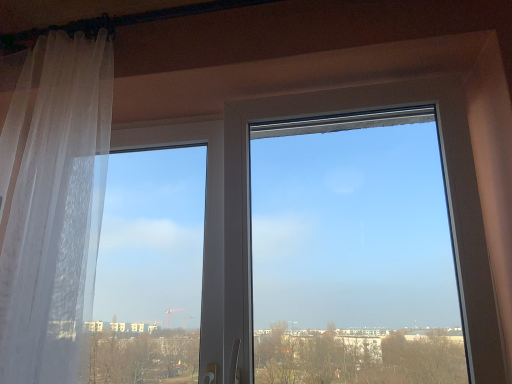
Describe the element at coordinates (353, 251) in the screenshot. I see `transparent glass window at center` at that location.

Locate an element on the screen. transparent glass window at center is located at coordinates (353, 251).

Find the location of a particular element. This screenshot has height=384, width=512. transparent glass window at center is located at coordinates (353, 251).